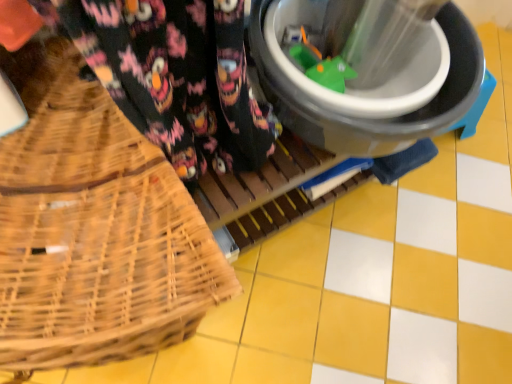
Where is `vacant area located to the right-hand side of woven wood picnic basket at left`? vacant area located to the right-hand side of woven wood picnic basket at left is located at coordinates (284, 319).